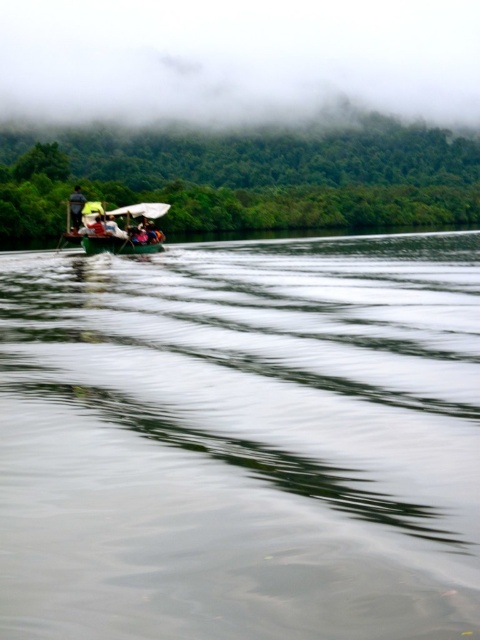
Question: From the image, what is the correct spatial relationship of green plastic boat at center in relation to green fabric boat at center?

Choices:
 (A) left
 (B) right

Answer: (B)

Question: Which point is farther to the camera?

Choices:
 (A) green plastic canoe at center
 (B) green fabric boat at center

Answer: (B)

Question: Which point appears closest to the camera in this image?

Choices:
 (A) (96, 400)
 (B) (120, 244)
 (C) (103, 205)
 (D) (99, 225)

Answer: (A)

Question: Which point appears farthest from the camera in this image?

Choices:
 (A) (147, 246)
 (B) (98, 220)
 (C) (92, 243)
 (D) (181, 525)

Answer: (A)

Question: In this image, where is green rubber boat at upper left located relative to green fabric boat at center?

Choices:
 (A) right
 (B) left

Answer: (A)

Question: Can you confirm if green rubber boat at upper left is positioned below green plastic canoe at center?

Choices:
 (A) yes
 (B) no

Answer: (A)